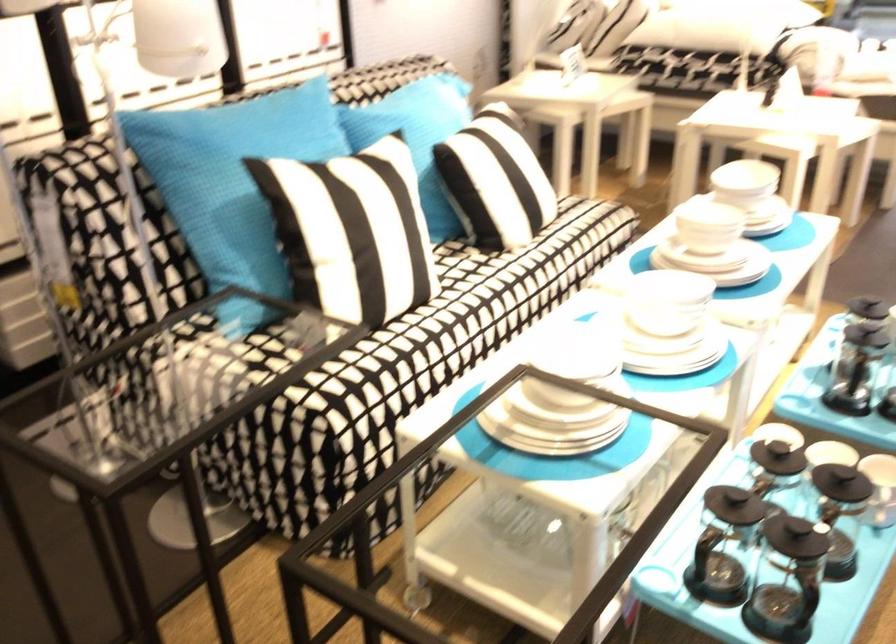
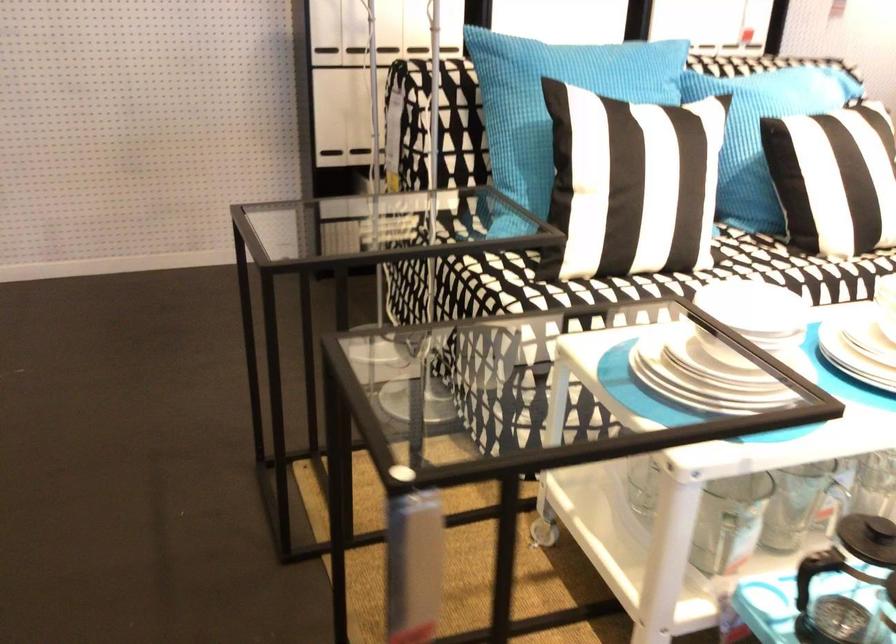
The point at (565, 415) is marked in the first image. Where is the corresponding point in the second image?

(709, 373)